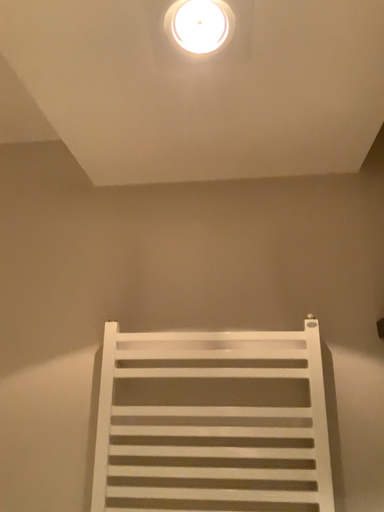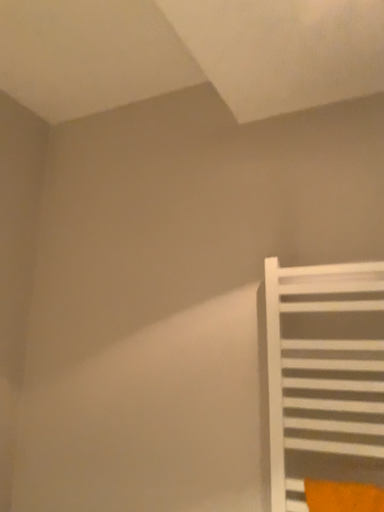
Question: How did the camera likely rotate when shooting the video?

Choices:
 (A) rotated left
 (B) rotated right

Answer: (A)